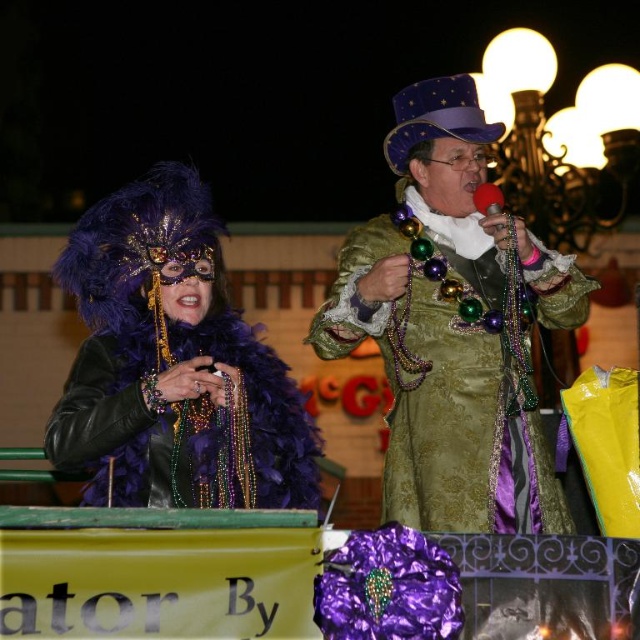
Is shiny gold coat at center thinner than purple feather boa at center?

Incorrect, shiny gold coat at center's width is not less than purple feather boa at center's.

Which is above, shiny gold coat at center or purple feather boa at center?

shiny gold coat at center is higher up.

Between point (483, 161) and point (160, 241), which one is positioned in front?

Point (160, 241) is in front.

Find the location of a particular element. shiny gold coat at center is located at coordinates (442, 332).